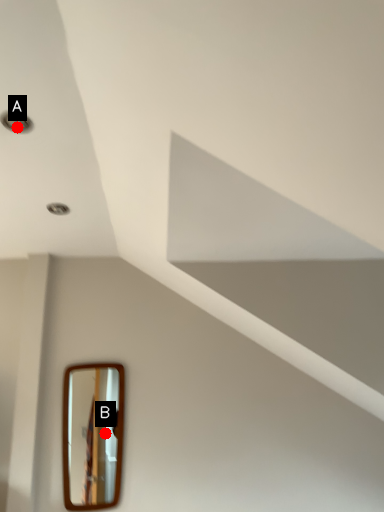
Question: Two points are circled on the image, labeled by A and B beside each circle. Among these points, which one is nearest to the camera?

Choices:
 (A) A is closer
 (B) B is closer

Answer: (A)